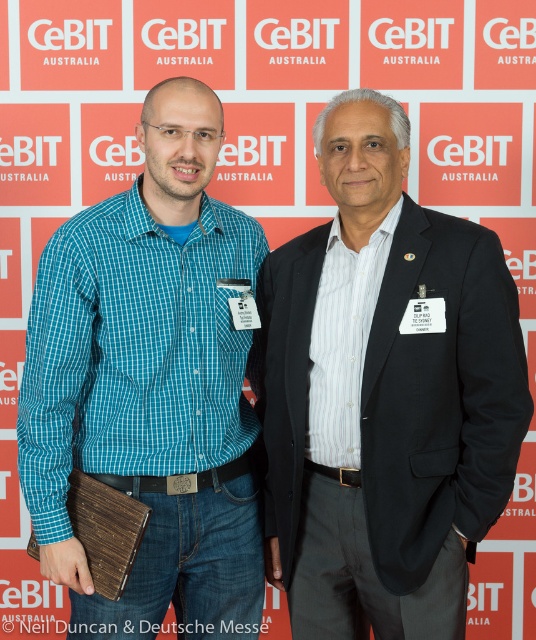
You are a photographer taking a picture of the two points in the image. Which point, point (419, 529) or point (152, 198), will appear larger in your photo?

Point (419, 529) is closer to the viewer than point (152, 198), so it will appear larger in the photo.

You are a photographer setting up for a group photo. You need to ensure that both the dark gray suit at center and the teal checkered shirt at center are fully visible in the frame. Based on their sizes, which one might require more space between them to avoid overlapping?

The dark gray suit at center is wider than the teal checkered shirt at center, so it might require more space between them to avoid overlapping.